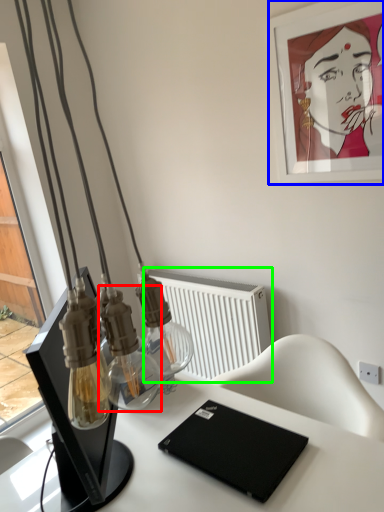
Question: Considering the real-world distances, which object is farthest from bottle (highlighted by a red box)? picture frame (highlighted by a blue box) or radiator (highlighted by a green box)?

Choices:
 (A) picture frame
 (B) radiator

Answer: (A)